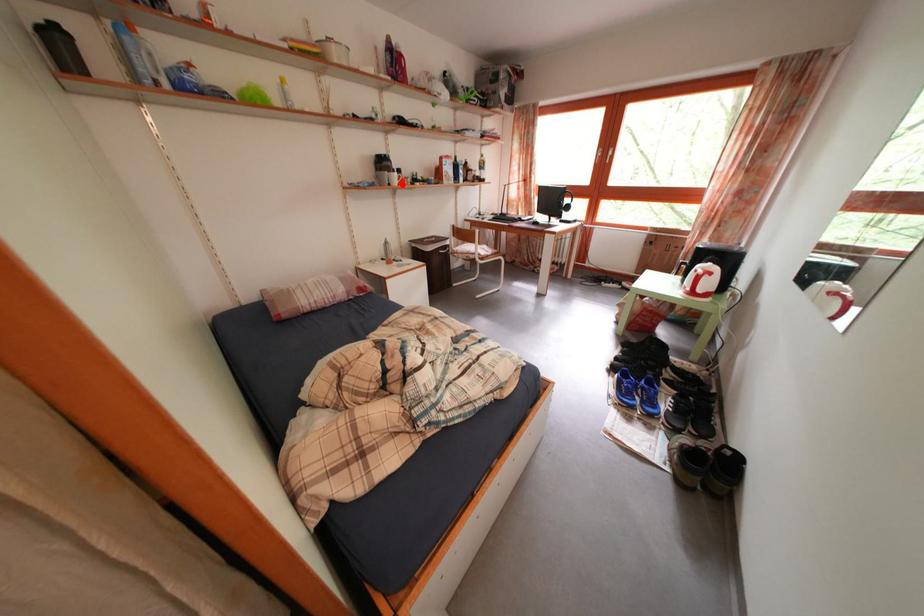
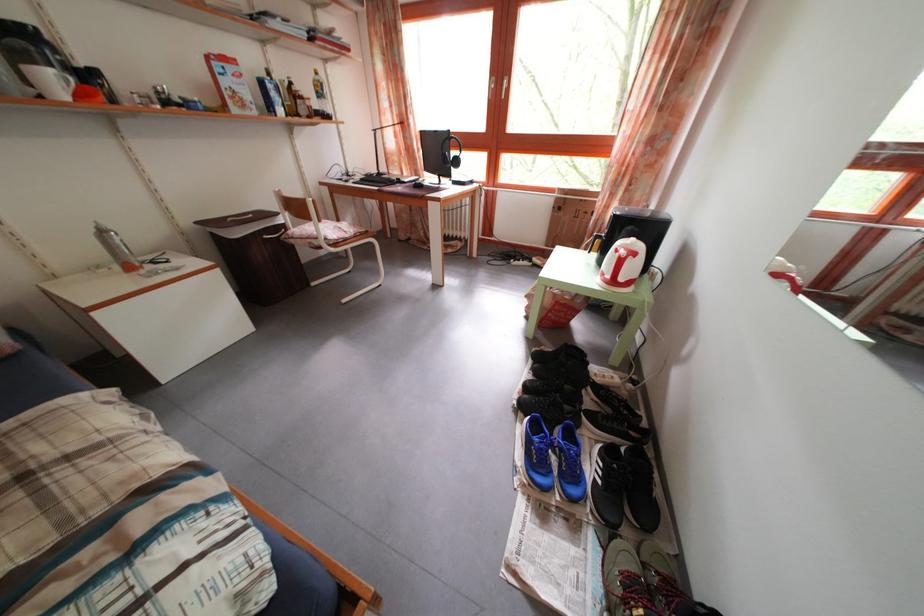
Locate, in the second image, the point that corresponds to the highlighted location in the first image.

(58, 87)